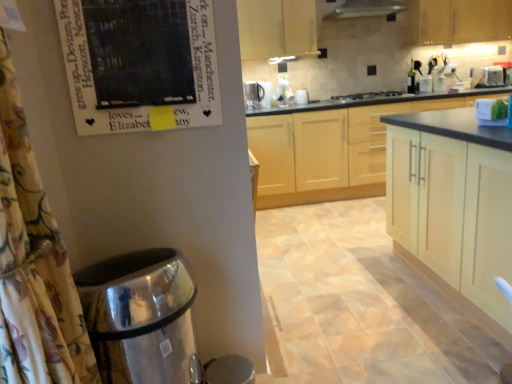
Question: Is metallic silver mug at upper center shorter than light wood cabinet at upper right, acting as the fourth cabinetry starting from the front?

Choices:
 (A) no
 (B) yes

Answer: (B)

Question: Is the position of metallic silver mug at upper center less distant than that of light wood cabinet at upper right, which is counted as the 1th cabinetry, starting from the back?

Choices:
 (A) yes
 (B) no

Answer: (B)

Question: Is metallic silver mug at upper center completely or partially outside of light wood cabinet at upper right, acting as the fourth cabinetry starting from the front?

Choices:
 (A) yes
 (B) no

Answer: (A)

Question: From the image's perspective, is metallic silver mug at upper center below light wood cabinet at upper right, acting as the fourth cabinetry starting from the front?

Choices:
 (A) yes
 (B) no

Answer: (A)

Question: From the image's perspective, does metallic silver mug at upper center appear higher than light wood cabinet at upper right, which is counted as the 1th cabinetry, starting from the back?

Choices:
 (A) no
 (B) yes

Answer: (A)

Question: From a real-world perspective, relative to light wood cabinet at upper right, which is counted as the 1th cabinetry, starting from the back, is light wood cabinets at center, placed as the third cabinetry when sorted from back to front, vertically above or below?

Choices:
 (A) below
 (B) above

Answer: (A)

Question: Do you think light wood cabinets at center, placed as the third cabinetry when sorted from back to front, is within light wood cabinet at upper right, acting as the fourth cabinetry starting from the front, or outside of it?

Choices:
 (A) inside
 (B) outside

Answer: (B)

Question: Does point (313, 168) appear closer or farther from the camera than point (496, 9)?

Choices:
 (A) closer
 (B) farther

Answer: (A)

Question: Considering the positions of light wood cabinets at center, placed as the third cabinetry when sorted from back to front, and light wood cabinet at upper right, which is counted as the 1th cabinetry, starting from the back, in the image, is light wood cabinets at center, placed as the third cabinetry when sorted from back to front, wider or thinner than light wood cabinet at upper right, which is counted as the 1th cabinetry, starting from the back,?

Choices:
 (A) thin
 (B) wide

Answer: (B)

Question: Relative to black glass stove at center, is black matte poster at upper left in front or behind?

Choices:
 (A) behind
 (B) front

Answer: (B)

Question: Looking at the image, does black matte poster at upper left seem bigger or smaller compared to black glass stove at center?

Choices:
 (A) small
 (B) big

Answer: (A)

Question: From a real-world perspective, relative to black glass stove at center, is black matte poster at upper left vertically above or below?

Choices:
 (A) below
 (B) above

Answer: (B)

Question: Does point click(x=208, y=92) appear closer or farther from the camera than point click(x=399, y=91)?

Choices:
 (A) farther
 (B) closer

Answer: (B)

Question: In the image, is floral fabric shower curtain at left positioned in front of or behind green glass bottle at upper right?

Choices:
 (A) behind
 (B) front

Answer: (B)

Question: Considering the positions of point (61, 286) and point (414, 66), is point (61, 286) closer or farther from the camera than point (414, 66)?

Choices:
 (A) farther
 (B) closer

Answer: (B)